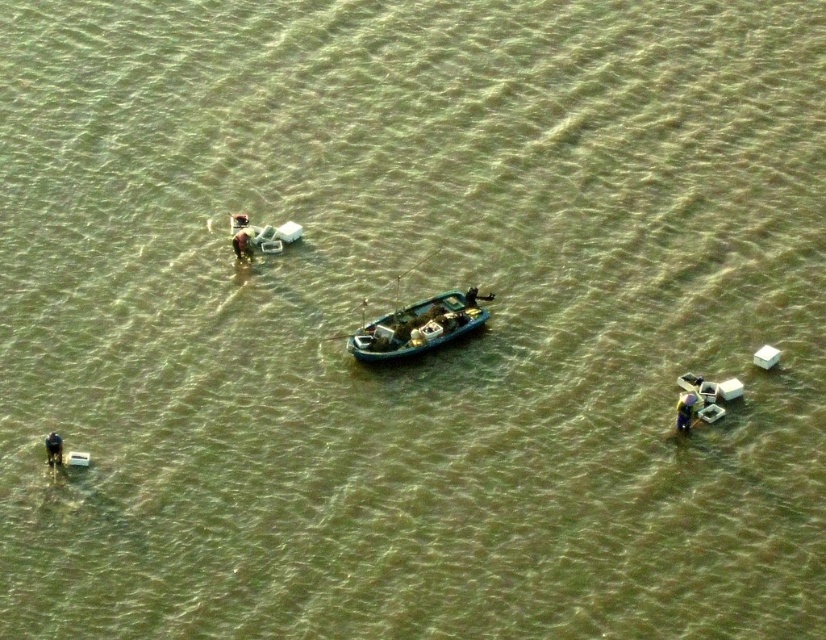
You are navigating a small boat in the center of the water. There are two points marked on your map at coordinates point [681,406] and point [244,230]. Which point should you steer towards first if you want to reach the point that is closer to your current position?

Point [244,230] is closer to your current position because it is behind point [681,406]. Since you are in the center, the point [244,230] is nearer to you.

You are a photographer trying to capture a group photo of the green fabric person at lower right and the dark blue fabric person at center. Which person should you focus on first to ensure they are in the frame?

The green fabric person at lower right has a smaller size compared to dark blue fabric person at center, so you should focus on the green fabric person at lower right first to ensure they are in the frame since they are smaller and might be harder to see.